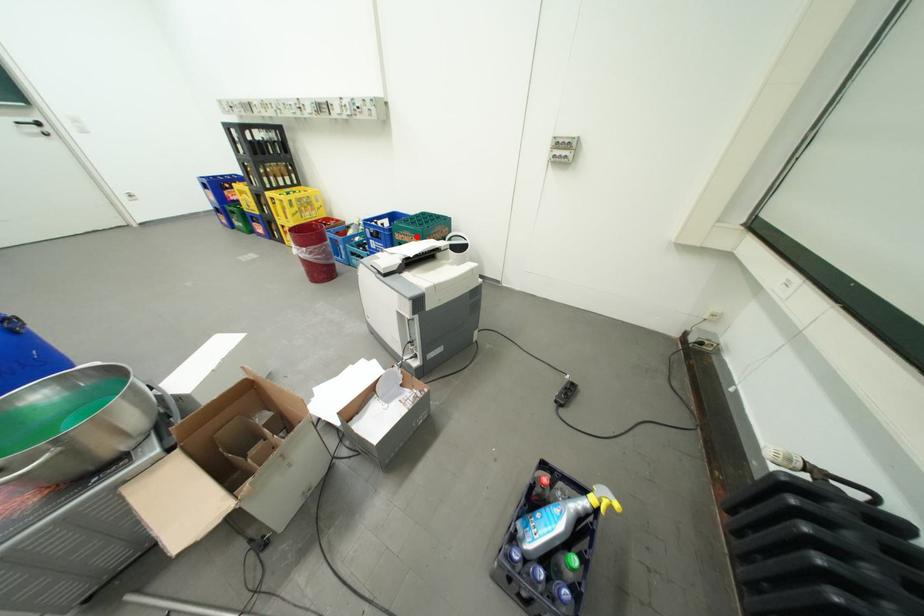
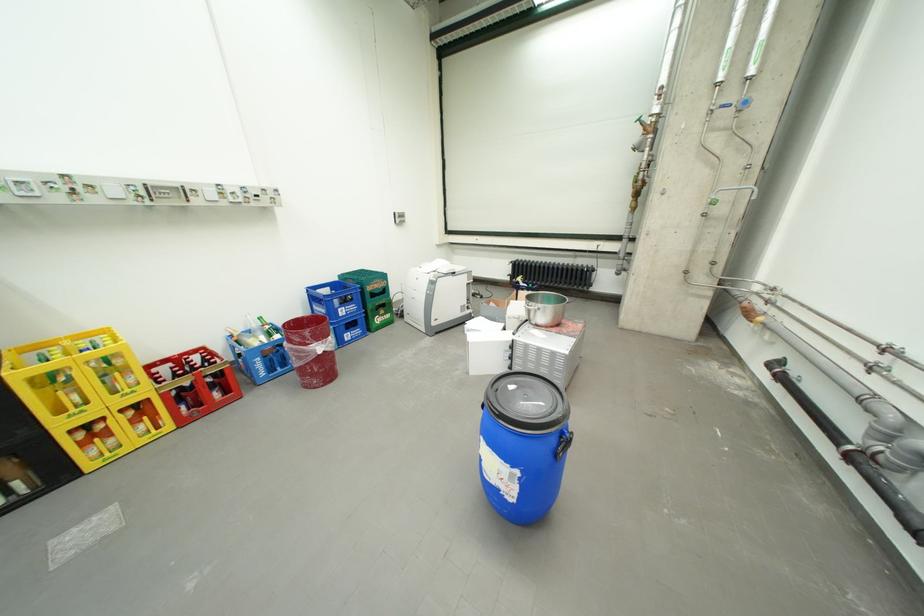
In the second image, find the point that corresponds to the highlighted location in the first image.

(386, 285)